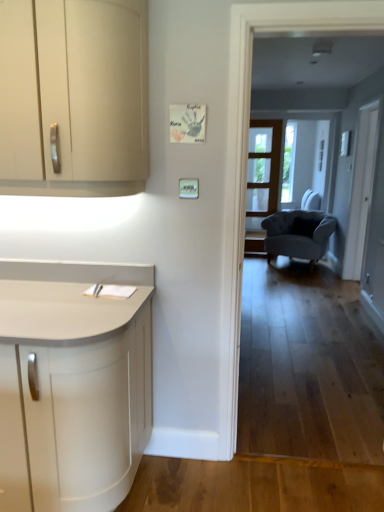
Question: Relative to white glass screen door at right, arranged as the 1th screen door when viewed from the right, is velvet blue armchair at center in front or behind?

Choices:
 (A) front
 (B) behind

Answer: (B)

Question: From a real-world perspective, is velvet blue armchair at center above or below white glass screen door at right, marked as the 2th screen door in a left-to-right arrangement?

Choices:
 (A) above
 (B) below

Answer: (B)

Question: Estimate the real-world distances between objects in this image. Which object is closer to the clear glass screen door at center, which ranks as the 1th screen door in back-to-front order?

Choices:
 (A) matte cream cabinet at left
 (B) white glass screen door at right, arranged as the 1th screen door when viewed from the right
 (C) velvet blue armchair at center

Answer: (C)

Question: Which object is the closest to the matte cream cabinet at left?

Choices:
 (A) velvet blue armchair at center
 (B) white glass screen door at right, arranged as the 1th screen door when viewed from the right
 (C) clear glass screen door at center, marked as the 2th screen door in a right-to-left arrangement

Answer: (B)